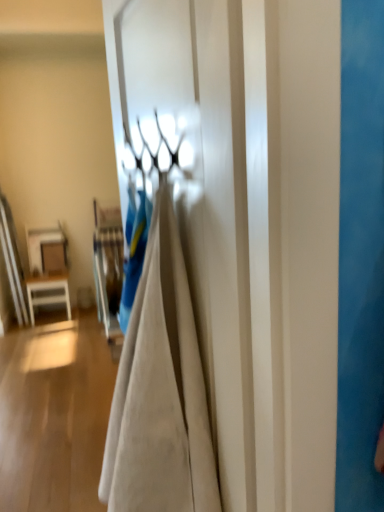
Question: Is white matte door at center smaller than white glossy table at left?

Choices:
 (A) yes
 (B) no

Answer: (B)

Question: Is white matte door at center further to camera compared to white glossy table at left?

Choices:
 (A) yes
 (B) no

Answer: (B)

Question: From the image's perspective, does white matte door at center appear lower than white glossy table at left?

Choices:
 (A) no
 (B) yes

Answer: (A)

Question: From a real-world perspective, is white matte door at center positioned under white glossy table at left based on gravity?

Choices:
 (A) no
 (B) yes

Answer: (A)

Question: Is white matte door at center wider than white glossy table at left?

Choices:
 (A) no
 (B) yes

Answer: (A)

Question: From a real-world perspective, does white matte door at center stand above white glossy table at left?

Choices:
 (A) yes
 (B) no

Answer: (A)

Question: Does white glossy table at left turn towards white matte door at center?

Choices:
 (A) no
 (B) yes

Answer: (B)

Question: Can we say white glossy table at left lies outside white matte door at center?

Choices:
 (A) yes
 (B) no

Answer: (A)

Question: Is white glossy table at left at the right side of white matte door at center?

Choices:
 (A) no
 (B) yes

Answer: (A)

Question: Can you confirm if white glossy table at left is taller than white matte door at center?

Choices:
 (A) yes
 (B) no

Answer: (B)

Question: Is white glossy table at left oriented away from white matte door at center?

Choices:
 (A) yes
 (B) no

Answer: (B)

Question: Is the position of white glossy table at left more distant than that of white matte door at center?

Choices:
 (A) no
 (B) yes

Answer: (B)

Question: From a real-world perspective, is white matte door at center physically located above or below white glossy table at left?

Choices:
 (A) below
 (B) above

Answer: (B)